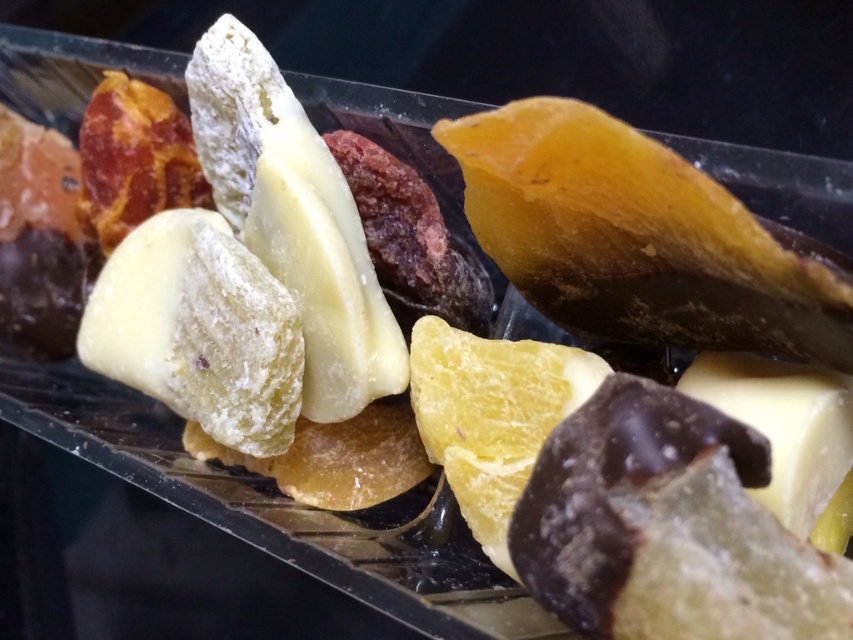
Which is below, white crumbly cheese at center or white creamy cheese at lower right?

white creamy cheese at lower right

Is white crumbly cheese at center taller than white creamy cheese at lower right?

Correct, white crumbly cheese at center is much taller as white creamy cheese at lower right.

Locate an element on the screen. This screenshot has width=853, height=640. white crumbly cheese at center is located at coordinates (198, 330).

Between point (260, 176) and point (247, 426), which one is positioned behind?

Positioned behind is point (260, 176).

Which is in front, point (254, 209) or point (199, 378)?

Positioned in front is point (199, 378).

You are a GUI agent. You are given a task and a screenshot of the screen. Output one action in this format:
    pyautogui.click(x=<x>, y=<y>)
    Task: Click on the white powdery cheese at center
    The height and width of the screenshot is (640, 853).
    Given the screenshot: What is the action you would take?
    pyautogui.click(x=293, y=220)

Who is shorter, white powdery cheese at center or white creamy cheese at lower right?

With less height is white creamy cheese at lower right.

Measure the distance between white powdery cheese at center and camera.

34.69 inches

Image resolution: width=853 pixels, height=640 pixels. What do you see at coordinates (293, 220) in the screenshot? I see `white powdery cheese at center` at bounding box center [293, 220].

Find the location of a particular element. Image resolution: width=853 pixels, height=640 pixels. white powdery cheese at center is located at coordinates (293, 220).